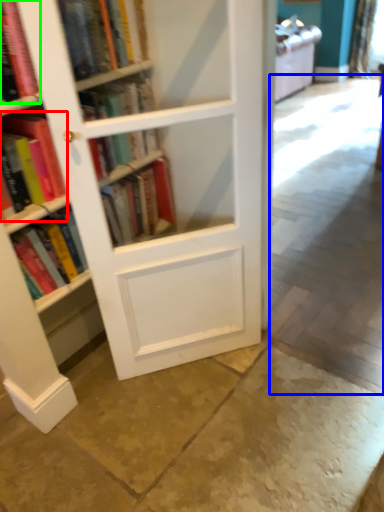
Question: Based on their relative distances, which object is farther from book (highlighted by a red box)? Choose from concrete (highlighted by a blue box) and book (highlighted by a green box).

Choices:
 (A) concrete
 (B) book

Answer: (A)